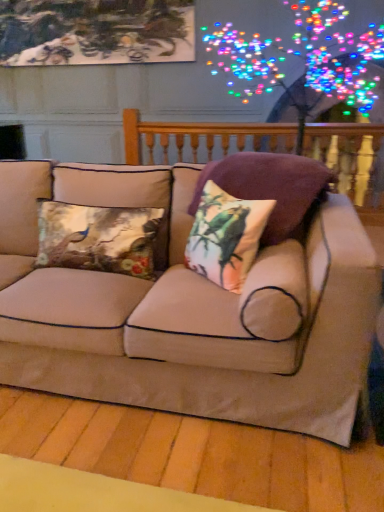
Question: From the image's perspective, is velvet floral pillow at center, the 1th pillow when ordered from right to left, located beneath printed fabric cushion at center, acting as the second pillow starting from the left?

Choices:
 (A) yes
 (B) no

Answer: (B)

Question: Considering the relative sizes of velvet floral pillow at center, placed as the third pillow when sorted from left to right, and printed fabric cushion at center, acting as the second pillow starting from the left, in the image provided, is velvet floral pillow at center, placed as the third pillow when sorted from left to right, taller than printed fabric cushion at center, acting as the second pillow starting from the left,?

Choices:
 (A) yes
 (B) no

Answer: (A)

Question: Does velvet floral pillow at center, placed as the third pillow when sorted from left to right, appear on the left side of printed fabric cushion at center, which is the second pillow in right-to-left order?

Choices:
 (A) no
 (B) yes

Answer: (A)

Question: Is velvet floral pillow at center, placed as the third pillow when sorted from left to right, far from printed fabric cushion at center, which is the second pillow in right-to-left order?

Choices:
 (A) no
 (B) yes

Answer: (A)

Question: From a real-world perspective, is velvet floral pillow at center, the 1th pillow when ordered from right to left, physically below printed fabric cushion at center, which is the second pillow in right-to-left order?

Choices:
 (A) no
 (B) yes

Answer: (A)

Question: Considering their positions, is printed fabric cushion at center, acting as the second pillow starting from the left, located in front of or behind velvet floral pillow at center, placed as the third pillow when sorted from left to right?

Choices:
 (A) front
 (B) behind

Answer: (A)

Question: From the image's perspective, is printed fabric cushion at center, which is the second pillow in right-to-left order, positioned above or below velvet floral pillow at center, placed as the third pillow when sorted from left to right?

Choices:
 (A) above
 (B) below

Answer: (B)

Question: Based on their sizes in the image, would you say printed fabric cushion at center, acting as the second pillow starting from the left, is bigger or smaller than velvet floral pillow at center, placed as the third pillow when sorted from left to right?

Choices:
 (A) small
 (B) big

Answer: (A)

Question: From their relative heights in the image, would you say printed fabric cushion at center, which is the second pillow in right-to-left order, is taller or shorter than velvet floral pillow at center, the 1th pillow when ordered from right to left?

Choices:
 (A) short
 (B) tall

Answer: (A)

Question: Considering the positions of velvet floral pillow at center, placed as the third pillow when sorted from left to right, and printed fabric cushion at center, which is the second pillow in right-to-left order, in the image, is velvet floral pillow at center, placed as the third pillow when sorted from left to right, taller or shorter than printed fabric cushion at center, which is the second pillow in right-to-left order,?

Choices:
 (A) tall
 (B) short

Answer: (A)

Question: Considering their positions, is velvet floral pillow at center, the 1th pillow when ordered from right to left, located in front of or behind printed fabric cushion at center, acting as the second pillow starting from the left?

Choices:
 (A) front
 (B) behind

Answer: (B)

Question: Is velvet floral pillow at center, placed as the third pillow when sorted from left to right, to the left or to the right of printed fabric cushion at center, acting as the second pillow starting from the left, in the image?

Choices:
 (A) left
 (B) right

Answer: (B)

Question: From the image's perspective, is velvet floral pillow at center, the 1th pillow when ordered from right to left, above or below printed fabric cushion at center, which is the second pillow in right-to-left order?

Choices:
 (A) above
 (B) below

Answer: (A)

Question: Considering the relative positions of wooden balustrade at upper center and beige fabric couch at center in the image provided, is wooden balustrade at upper center to the left or to the right of beige fabric couch at center?

Choices:
 (A) right
 (B) left

Answer: (A)

Question: Is wooden balustrade at upper center bigger or smaller than beige fabric couch at center?

Choices:
 (A) big
 (B) small

Answer: (B)